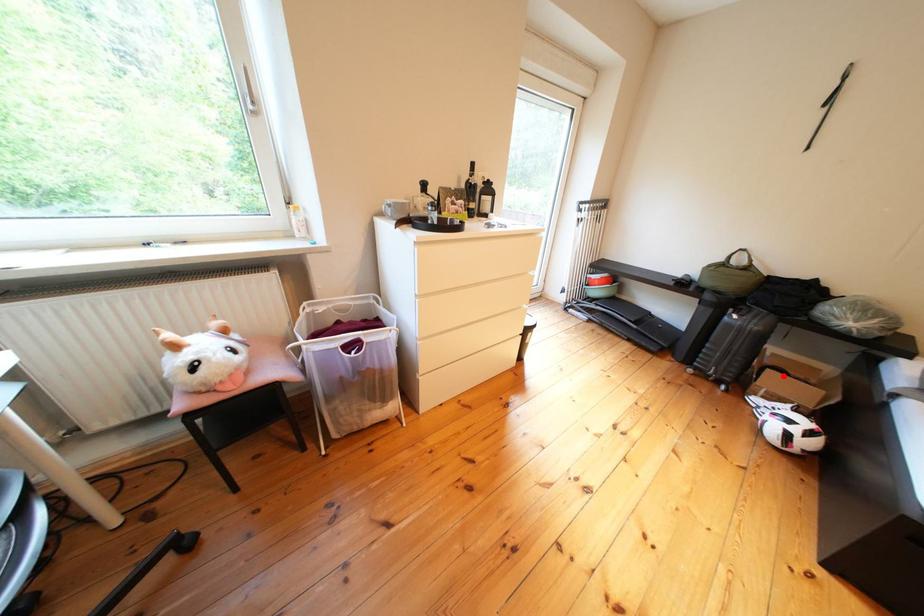
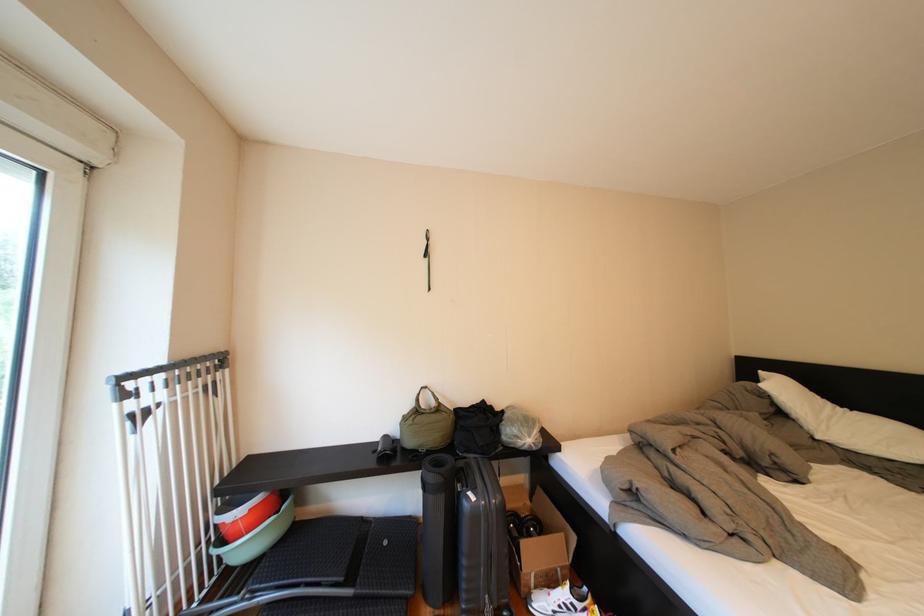
Question: I am providing you with two images of the same scene from different viewpoints. A red point is shown in image1. For the corresponding object point in image2, is it positioned nearer or farther from the camera?

Choices:
 (A) Nearer
 (B) Farther

Answer: (A)